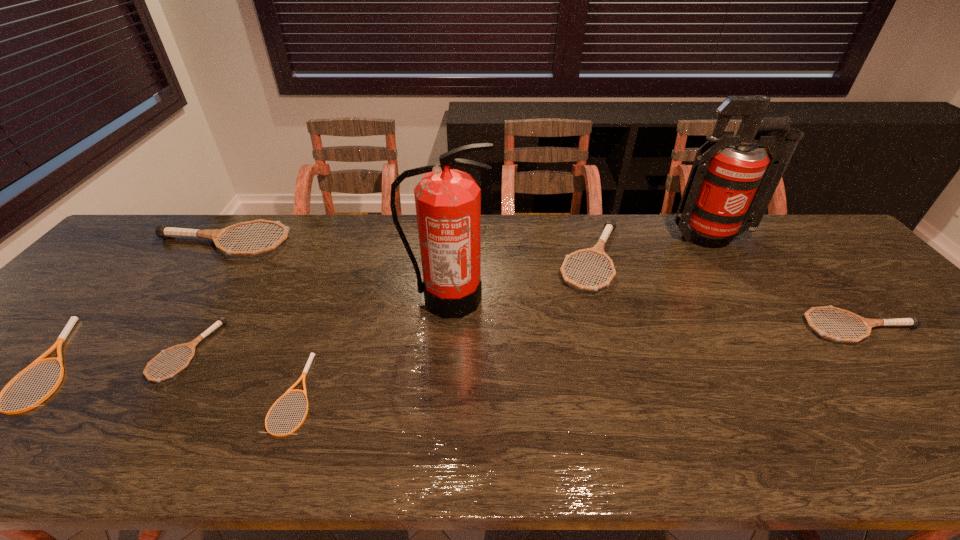
You are a GUI agent. You are given a task and a screenshot of the screen. Output one action in this format:
    pyautogui.click(x=<x>, y=<y>)
    Task: Click on the blank space located on the left of the fourth tennis racket from left to right
    
    Given the screenshot: What is the action you would take?
    [x=162, y=393]

Locate an element on the screen. fire extinguisher located at the far edge is located at coordinates (729, 188).

Where is `object that is at the near edge`? This screenshot has height=540, width=960. object that is at the near edge is located at coordinates (308, 364).

The width and height of the screenshot is (960, 540). I want to click on object at the left edge, so click(164, 231).

This screenshot has width=960, height=540. Identify the location of object positioned at the right edge. (912, 321).

Image resolution: width=960 pixels, height=540 pixels. Identify the location of object that is at the far left corner. (164, 231).

In the image, there is a desktop. Where is `vacant space at the far edge`? vacant space at the far edge is located at coordinates click(x=287, y=225).

At what (x,y) coordinates should I click in order to perform the action: click on vacant space at the near edge of the desktop. Please return your answer as a coordinate pair (x, y). Image resolution: width=960 pixels, height=540 pixels. Looking at the image, I should click on (420, 451).

In the image, there is a desktop. Identify the location of vacant space at the left edge. The height and width of the screenshot is (540, 960). (90, 303).

In the image, there is a desktop. In order to click on vacant space at the right edge in this screenshot , I will do `click(846, 303)`.